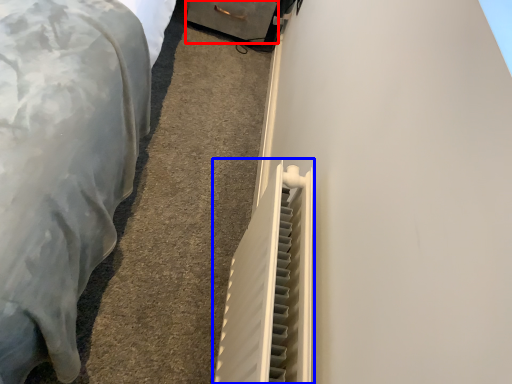
Question: Among these objects, which one is nearest to the camera, drawer (highlighted by a red box) or radiator (highlighted by a blue box)?

Choices:
 (A) drawer
 (B) radiator

Answer: (B)